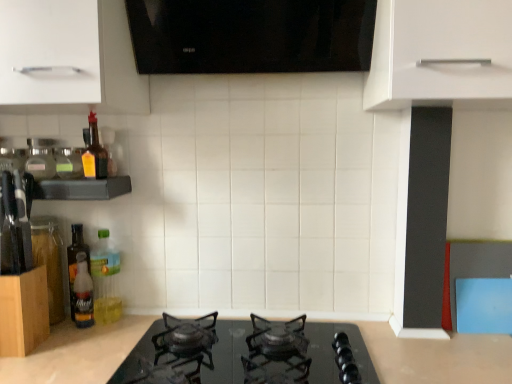
What do you see at coordinates (82, 188) in the screenshot? I see `clear plastic shelf at left` at bounding box center [82, 188].

The width and height of the screenshot is (512, 384). I want to click on translucent glass bottle at left, which is counted as the 2th bottle, starting from the left, so click(76, 260).

This screenshot has width=512, height=384. Describe the element at coordinates (437, 357) in the screenshot. I see `black glass cooktop at center` at that location.

Describe the element at coordinates (94, 153) in the screenshot. I see `translucent amber glass bottle at left, positioned as the second bottle in right-to-left order` at that location.

In order to face translucent plastic bottle at left, arranged as the 3th bottle when viewed from the right, should I rotate leftwards or rightwards?

Turn left approximately 22.347 degrees to face it.

Find the location of a particular element. This screenshot has width=512, height=384. clear plastic shelf at left is located at coordinates (82, 188).

Is translucent amber glass bottle at left, positioned as the 5th bottle in left-to-right order, thinner than translucent plastic bottle at left, arranged as the first bottle when viewed from the right?

Yes.

Who is shorter, translucent amber glass bottle at left, positioned as the 5th bottle in left-to-right order, or translucent plastic bottle at left, arranged as the first bottle when viewed from the right?

Standing shorter between the two is translucent amber glass bottle at left, positioned as the 5th bottle in left-to-right order.

Is translucent plastic bottle at left, arranged as the first bottle when viewed from the right, at the back of translucent amber glass bottle at left, positioned as the second bottle in right-to-left order?

translucent amber glass bottle at left, positioned as the second bottle in right-to-left order, is not turned away from translucent plastic bottle at left, arranged as the first bottle when viewed from the right.

Is translucent amber glass bottle at left, positioned as the second bottle in right-to-left order, spatially inside translucent plastic bottle at left, arranged as the first bottle when viewed from the right, or outside of it?

translucent amber glass bottle at left, positioned as the second bottle in right-to-left order, cannot be found inside translucent plastic bottle at left, arranged as the first bottle when viewed from the right.

From a real-world perspective, is clear glass jar at left, the 1th bottle from the left, under translucent glass bottle at left, which is counted as the 2th bottle, starting from the left?

No, from a real-world perspective, clear glass jar at left, the 1th bottle from the left, is not below translucent glass bottle at left, which is counted as the 2th bottle, starting from the left.

Looking at the image, does clear glass jar at left, the 1th bottle from the left, seem bigger or smaller compared to translucent glass bottle at left, placed as the fifth bottle when sorted from right to left?

In the image, clear glass jar at left, the 1th bottle from the left, appears to be smaller than translucent glass bottle at left, placed as the fifth bottle when sorted from right to left.

Where is `the 1st bottle counting from the right of the clear glass jar at left, the 6th bottle from the right`? The width and height of the screenshot is (512, 384). the 1st bottle counting from the right of the clear glass jar at left, the 6th bottle from the right is located at coordinates (76, 260).

Would you say clear glass jar at left, the 1th bottle from the left, is inside or outside translucent glass bottle at left, placed as the fifth bottle when sorted from right to left?

clear glass jar at left, the 1th bottle from the left, cannot be found inside translucent glass bottle at left, placed as the fifth bottle when sorted from right to left.

From the image's perspective, is translucent glass bottle at left, which is counted as the 2th bottle, starting from the left, positioned above or below wooden block at left, the first cabinetry in the bottom-to-top sequence?

Based on their image positions, translucent glass bottle at left, which is counted as the 2th bottle, starting from the left, is located above wooden block at left, the first cabinetry in the bottom-to-top sequence.

There is a wooden block at left, the second cabinetry positioned from the top. Where is `the 3rd bottle above it (from the image's perspective)`? the 3rd bottle above it (from the image's perspective) is located at coordinates (76, 260).

Which is more to the right, translucent glass bottle at left, which is counted as the 2th bottle, starting from the left, or wooden block at left, the first cabinetry in the bottom-to-top sequence?

translucent glass bottle at left, which is counted as the 2th bottle, starting from the left.

How much distance is there between translucent glass bottle at left, placed as the fifth bottle when sorted from right to left, and wooden block at left, the first cabinetry in the bottom-to-top sequence?

translucent glass bottle at left, placed as the fifth bottle when sorted from right to left, and wooden block at left, the first cabinetry in the bottom-to-top sequence, are 6.88 inches apart from each other.

From a real-world perspective, is translucent yellow bottle at left, the 4th bottle viewed from the right, above or below clear plastic shelf at left?

Clearly, from a real-world perspective, translucent yellow bottle at left, the 4th bottle viewed from the right, is above clear plastic shelf at left.

Which object is further away from the camera taking this photo, translucent yellow bottle at left, positioned as the third bottle in left-to-right order, or clear plastic shelf at left?

Positioned behind is translucent yellow bottle at left, positioned as the third bottle in left-to-right order.

Would you say clear plastic shelf at left is part of translucent yellow bottle at left, the 4th bottle viewed from the right,'s contents?

No, clear plastic shelf at left is not a part of translucent yellow bottle at left, the 4th bottle viewed from the right.

Is point (64, 175) farther from camera compared to point (67, 183)?

Yes.

Is clear glass jar at left, the 6th bottle from the right, with clear plastic shelf at left?

Yes, clear glass jar at left, the 6th bottle from the right, and clear plastic shelf at left clearly make contact.

Considering the sizes of objects clear glass jar at left, the 6th bottle from the right, and clear plastic shelf at left in the image provided, who is shorter, clear glass jar at left, the 6th bottle from the right, or clear plastic shelf at left?

clear plastic shelf at left.

From the image's perspective, is clear glass jar at left, the 6th bottle from the right, on clear plastic shelf at left?

Correct, clear glass jar at left, the 6th bottle from the right, appears higher than clear plastic shelf at left in the image.

Is clear glass jar at left, the 1th bottle from the left, facing towards clear plastic shelf at left?

No, clear glass jar at left, the 1th bottle from the left, is not facing towards clear plastic shelf at left.

In the image, is translucent plastic bottle at left, arranged as the first bottle when viewed from the right, positioned in front of or behind clear plastic shelf at left?

In the image, translucent plastic bottle at left, arranged as the first bottle when viewed from the right, appears behind clear plastic shelf at left.

Can you confirm if translucent plastic bottle at left, arranged as the first bottle when viewed from the right, is smaller than clear plastic shelf at left?

Yes, translucent plastic bottle at left, arranged as the first bottle when viewed from the right, is smaller than clear plastic shelf at left.

From the image's perspective, is translucent plastic bottle at left, marked as the sixth bottle in a left-to-right arrangement, positioned above or below clear plastic shelf at left?

Based on their image positions, translucent plastic bottle at left, marked as the sixth bottle in a left-to-right arrangement, is located beneath clear plastic shelf at left.

Does point (121, 304) come in front of point (77, 189)?

No, it is behind (77, 189).

Is translucent yellow bottle at left, the 4th bottle viewed from the right, turned away from translucent plastic bottle at left, arranged as the 3th bottle when viewed from the right?

No, translucent yellow bottle at left, the 4th bottle viewed from the right,'s orientation is not away from translucent plastic bottle at left, arranged as the 3th bottle when viewed from the right.

Is translucent yellow bottle at left, positioned as the third bottle in left-to-right order, in front of or behind translucent plastic bottle at left, the 4th bottle viewed from the left, in the image?

Visually, translucent yellow bottle at left, positioned as the third bottle in left-to-right order, is located in front of translucent plastic bottle at left, the 4th bottle viewed from the left.

From the picture: Would you say translucent yellow bottle at left, positioned as the third bottle in left-to-right order, contains translucent plastic bottle at left, the 4th bottle viewed from the left?

Actually, translucent plastic bottle at left, the 4th bottle viewed from the left, is outside translucent yellow bottle at left, positioned as the third bottle in left-to-right order.

From a real-world perspective, count 3rd bottles downward from the translucent yellow bottle at left, the 4th bottle viewed from the right, and point to it. Please provide its 2D coordinates.

[(83, 293)]

The width and height of the screenshot is (512, 384). What are the coordinates of `bottle on the right of translucent amber glass bottle at left, positioned as the 5th bottle in left-to-right order` in the screenshot? It's located at (105, 280).

From the image's perspective, starting from the translucent glass bottle at left, which is counted as the 2th bottle, starting from the left, which bottle is the 2nd one above? Please provide its 2D coordinates.

[(41, 158)]

Considering their positions, is white matte cabinet handle at upper left, marked as the second cabinetry in a bottom-to-top arrangement, positioned closer to clear glass jar at left, the 6th bottle from the right, than translucent plastic bottle at left, arranged as the 3th bottle when viewed from the right?

Based on the image, translucent plastic bottle at left, arranged as the 3th bottle when viewed from the right, appears to be nearer to clear glass jar at left, the 6th bottle from the right.

Looking at the image, which one is located closer to white matte cabinet handle at upper left, which is counted as the first cabinetry, starting from the top, translucent plastic bottle at left, arranged as the first bottle when viewed from the right, or black glass cooktop at center?

translucent plastic bottle at left, arranged as the first bottle when viewed from the right, is closer to white matte cabinet handle at upper left, which is counted as the first cabinetry, starting from the top.

From the image, which object appears to be nearer to translucent amber glass bottle at left, positioned as the 5th bottle in left-to-right order, wooden block at left, the second cabinetry positioned from the top, or translucent yellow bottle at left, the 4th bottle viewed from the right?

translucent yellow bottle at left, the 4th bottle viewed from the right, lies closer to translucent amber glass bottle at left, positioned as the 5th bottle in left-to-right order, than the other object.

From the image, which object appears to be farther from translucent plastic bottle at left, marked as the sixth bottle in a left-to-right arrangement, clear plastic shelf at left or translucent yellow bottle at left, the 4th bottle viewed from the right?

translucent yellow bottle at left, the 4th bottle viewed from the right.

When comparing their distances from translucent plastic bottle at left, the 4th bottle viewed from the left, does translucent glass bottle at left, placed as the fifth bottle when sorted from right to left, or translucent plastic bottle at left, marked as the sixth bottle in a left-to-right arrangement, seem further?

translucent plastic bottle at left, marked as the sixth bottle in a left-to-right arrangement.

Based on their spatial positions, is translucent yellow bottle at left, the 4th bottle viewed from the right, or translucent glass bottle at left, placed as the fifth bottle when sorted from right to left, closer to translucent plastic bottle at left, arranged as the first bottle when viewed from the right?

translucent glass bottle at left, placed as the fifth bottle when sorted from right to left, is positioned closer to the anchor translucent plastic bottle at left, arranged as the first bottle when viewed from the right.

Based on their spatial positions, is white matte cabinet handle at upper left, marked as the second cabinetry in a bottom-to-top arrangement, or clear glass jar at left, the 1th bottle from the left, further from clear plastic shelf at left?

Among the two, white matte cabinet handle at upper left, marked as the second cabinetry in a bottom-to-top arrangement, is located further to clear plastic shelf at left.

Which object lies nearer to the anchor point black glass cooktop at center, clear glass jar at left, the 1th bottle from the left, or translucent yellow bottle at left, the 4th bottle viewed from the right?

Based on the image, translucent yellow bottle at left, the 4th bottle viewed from the right, appears to be nearer to black glass cooktop at center.

Find the location of a particular element. The width and height of the screenshot is (512, 384). cabinetry that lies between white matte cabinet handle at upper left, which is counted as the first cabinetry, starting from the top, and black glass cooktop at center from top to bottom is located at coordinates (23, 312).

Identify the location of shelf between white matte cabinet handle at upper left, marked as the second cabinetry in a bottom-to-top arrangement, and translucent plastic bottle at left, arranged as the first bottle when viewed from the right, in the up-down direction. This screenshot has width=512, height=384. (82, 188).

The image size is (512, 384). I want to click on shelf between white matte cabinet handle at upper left, which is counted as the first cabinetry, starting from the top, and translucent plastic bottle at left, the 4th bottle viewed from the left, vertically, so click(x=82, y=188).

Locate an element on the screen. Image resolution: width=512 pixels, height=384 pixels. bottle between clear glass jar at left, the 1th bottle from the left, and translucent glass bottle at left, which is counted as the 2th bottle, starting from the left, in the vertical direction is located at coordinates (69, 163).